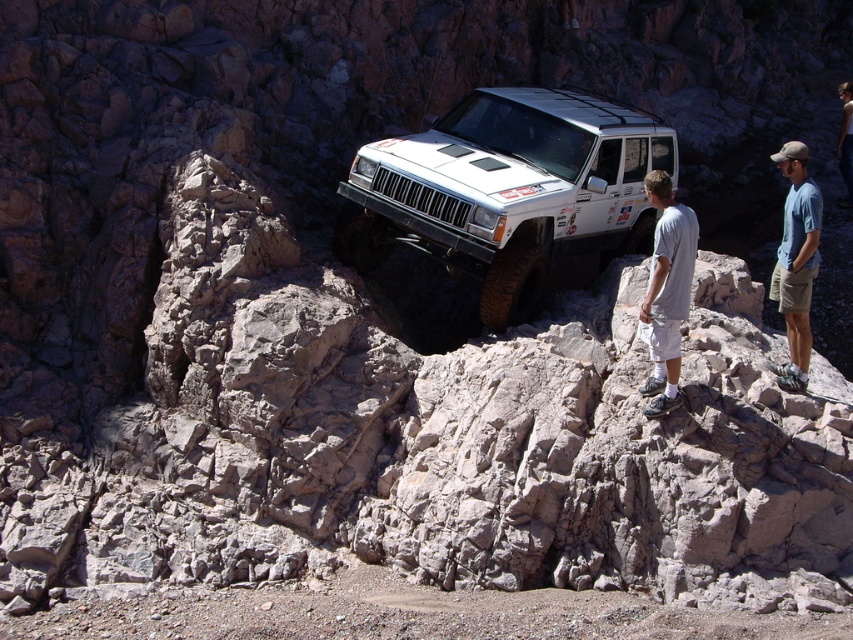
Can you confirm if white matte suv at center is positioned above white cotton shorts at lower right?

Yes, white matte suv at center is above white cotton shorts at lower right.

Does white matte suv at center have a smaller size compared to white cotton shorts at lower right?

No, white matte suv at center is not smaller than white cotton shorts at lower right.

Between point (380, 196) and point (674, 260), which one is positioned behind?

The point (380, 196) is behind.

Identify the location of white matte suv at center. (508, 189).

Does point (357, 252) come closer to viewer compared to point (804, 385)?

No.

Is white matte suv at center closer to the viewer compared to blue cotton shirt at right?

No, white matte suv at center is behind blue cotton shirt at right.

Locate an element on the screen. Image resolution: width=853 pixels, height=640 pixels. white matte suv at center is located at coordinates (508, 189).

Does white cotton shorts at lower right have a lesser height compared to blue cotton shirt at right?

Yes, white cotton shorts at lower right is shorter than blue cotton shirt at right.

Based on the photo, can you confirm if white cotton shorts at lower right is positioned to the left of blue cotton shirt at right?

Yes, white cotton shorts at lower right is to the left of blue cotton shirt at right.

Is point (660, 346) closer to camera compared to point (785, 243)?

Yes, it is.

This screenshot has height=640, width=853. Find the location of `white cotton shorts at lower right`. white cotton shorts at lower right is located at coordinates (666, 291).